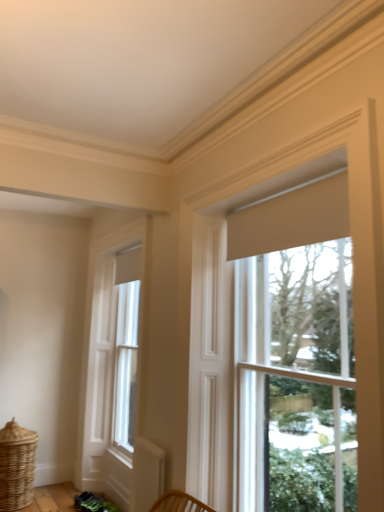
Question: From a real-world perspective, is white wood window at left, marked as the 1th window in a back-to-front arrangement, on woven natural basket at lower left?

Choices:
 (A) no
 (B) yes

Answer: (B)

Question: Considering the relative sizes of white wood window at left, marked as the 1th window in a back-to-front arrangement, and woven natural basket at lower left in the image provided, is white wood window at left, marked as the 1th window in a back-to-front arrangement, shorter than woven natural basket at lower left?

Choices:
 (A) no
 (B) yes

Answer: (A)

Question: From a real-world perspective, is white wood window at left, positioned as the 2th window in right-to-left order, located beneath woven natural basket at lower left?

Choices:
 (A) yes
 (B) no

Answer: (B)

Question: Would you consider white wood window at left, which is the 2th window in front-to-back order, to be distant from woven natural basket at lower left?

Choices:
 (A) yes
 (B) no

Answer: (A)

Question: Is white wood window at left, which appears as the 1th window when viewed from the left, facing away from woven natural basket at lower left?

Choices:
 (A) yes
 (B) no

Answer: (B)

Question: Is point (107, 369) closer or farther from the camera than point (264, 284)?

Choices:
 (A) farther
 (B) closer

Answer: (A)

Question: Is white wood window at left, marked as the 1th window in a back-to-front arrangement, bigger or smaller than matte cream roller shade at right, which ranks as the 2th window in back-to-front order?

Choices:
 (A) big
 (B) small

Answer: (A)

Question: Is white wood window at left, which is the 2th window in front-to-back order, to the left or to the right of matte cream roller shade at right, which is the 1th window from right to left, in the image?

Choices:
 (A) right
 (B) left

Answer: (B)

Question: Relative to matte cream roller shade at right, which appears as the first window when viewed from the front, is white wood window at left, which is the 2th window in front-to-back order, in front or behind?

Choices:
 (A) front
 (B) behind

Answer: (B)

Question: Choose the correct answer: Is white wood window at left, positioned as the 2th window in right-to-left order, inside beige fabric curtain at upper center or outside it?

Choices:
 (A) inside
 (B) outside

Answer: (B)

Question: From a real-world perspective, is white wood window at left, which appears as the 1th window when viewed from the left, above or below beige fabric curtain at upper center?

Choices:
 (A) below
 (B) above

Answer: (A)

Question: Is point (117, 408) closer or farther from the camera than point (344, 175)?

Choices:
 (A) closer
 (B) farther

Answer: (B)

Question: Considering the positions of white wood window at left, marked as the 1th window in a back-to-front arrangement, and beige fabric curtain at upper center in the image, is white wood window at left, marked as the 1th window in a back-to-front arrangement, bigger or smaller than beige fabric curtain at upper center?

Choices:
 (A) big
 (B) small

Answer: (A)

Question: Is woven natural basket at lower left wider or thinner than beige fabric curtain at upper center?

Choices:
 (A) thin
 (B) wide

Answer: (B)

Question: From the image's perspective, relative to beige fabric curtain at upper center, is woven natural basket at lower left above or below?

Choices:
 (A) above
 (B) below

Answer: (B)